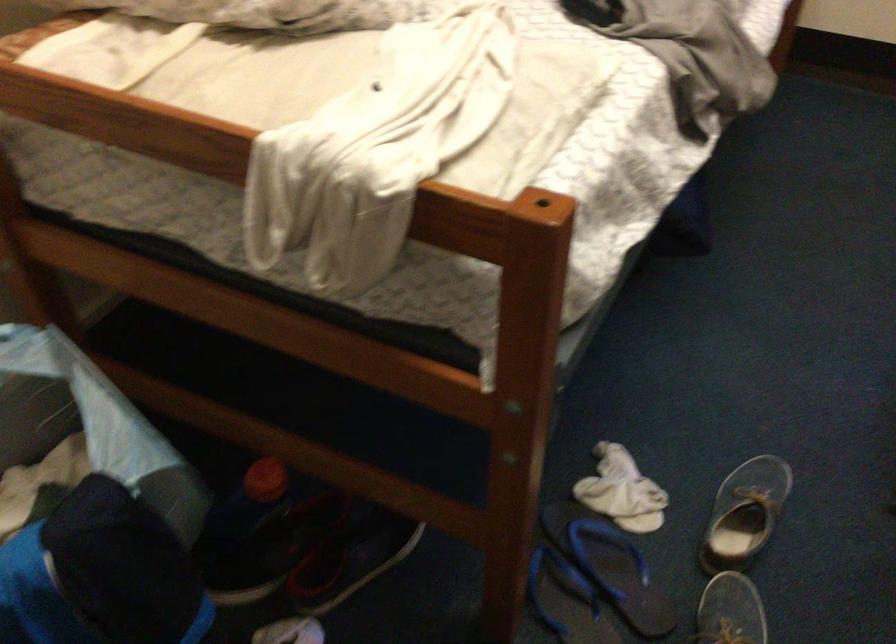
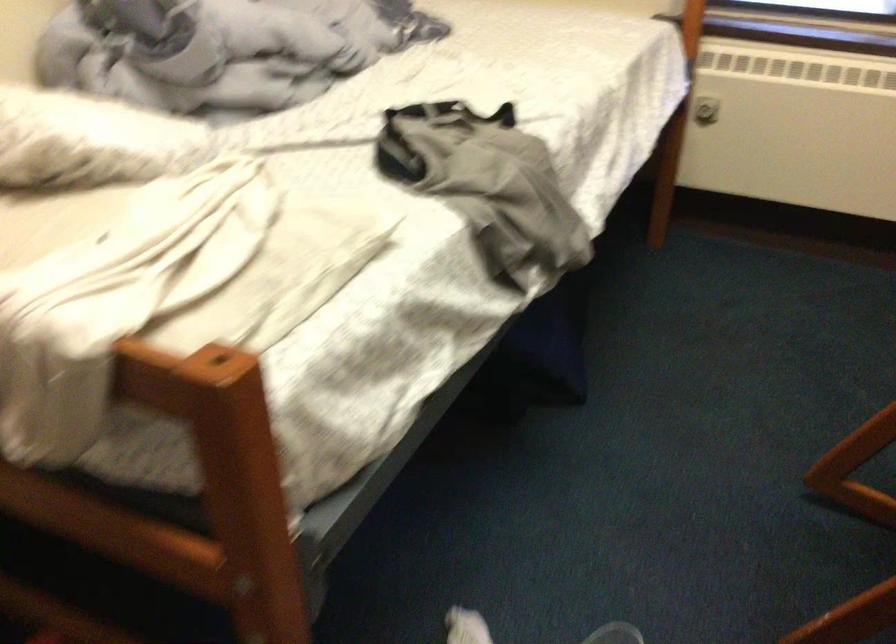
Question: What movement of the cameraman would produce the second image?

Choices:
 (A) Left
 (B) Right
 (C) Forward
 (D) Backward

Answer: (B)